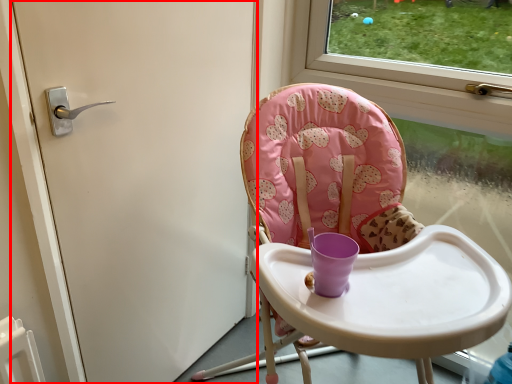
Question: From the image's perspective, where is door (annotated by the red box) located in relation to chair in the image?

Choices:
 (A) above
 (B) below

Answer: (A)